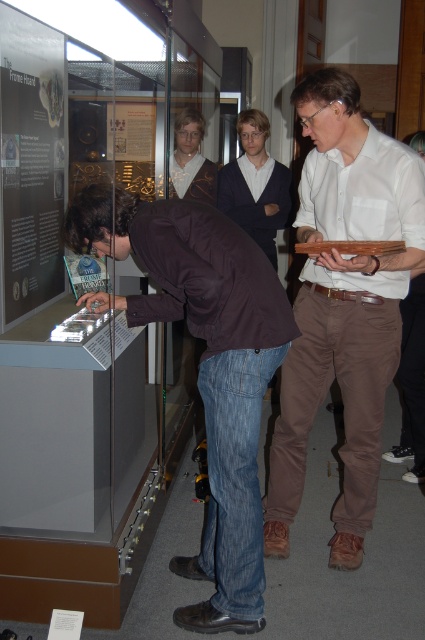
You are standing in front of the museum exhibit about The Frome Hoard. You notice two points marked on the display case. One is at coordinate point (175,314) and the other is at point (285,202). Which point is closer to you?

Point (175,314) is closer to the camera than point (285,202), so the point at (175,314) is closer to you.

You are standing in the museum and notice the brown leather jacket at lower left. Where exactly is it positioned in the image?

The brown leather jacket at lower left is located at point (206, 368).